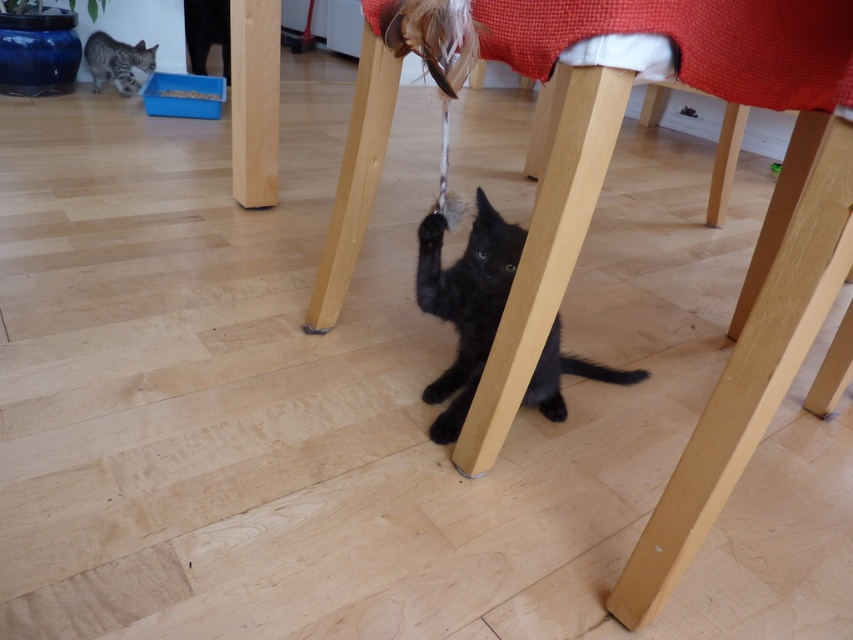
Between red woven cloth at upper center and black matte fur cat at lower center, which one appears on the left side from the viewer's perspective?

black matte fur cat at lower center

In the scene shown: Can you confirm if red woven cloth at upper center is shorter than black matte fur cat at lower center?

Correct, red woven cloth at upper center is not as tall as black matte fur cat at lower center.

Which is in front, point (500, 29) or point (479, 342)?

Positioned in front is point (500, 29).

Locate an element on the screen. This screenshot has width=853, height=640. red woven cloth at upper center is located at coordinates (694, 42).

Does black matte fur cat at lower center have a lesser width compared to striped fur cat at lower left?

In fact, black matte fur cat at lower center might be wider than striped fur cat at lower left.

Does black matte fur cat at lower center have a lesser height compared to striped fur cat at lower left?

In fact, black matte fur cat at lower center may be taller than striped fur cat at lower left.

The image size is (853, 640). What do you see at coordinates (465, 301) in the screenshot?
I see `black matte fur cat at lower center` at bounding box center [465, 301].

You are a GUI agent. You are given a task and a screenshot of the screen. Output one action in this format:
    pyautogui.click(x=<x>, y=<y>)
    Task: Click on the black matte fur cat at lower center
    This screenshot has height=640, width=853.
    Given the screenshot: What is the action you would take?
    coord(465,301)

Does wooden chair at center appear over striped fur cat at lower left?

No, wooden chair at center is not above striped fur cat at lower left.

Where is `wooden chair at center`? The width and height of the screenshot is (853, 640). wooden chair at center is located at coordinates (753, 278).

Locate an element on the screen. Image resolution: width=853 pixels, height=640 pixels. wooden chair at center is located at coordinates (753, 278).